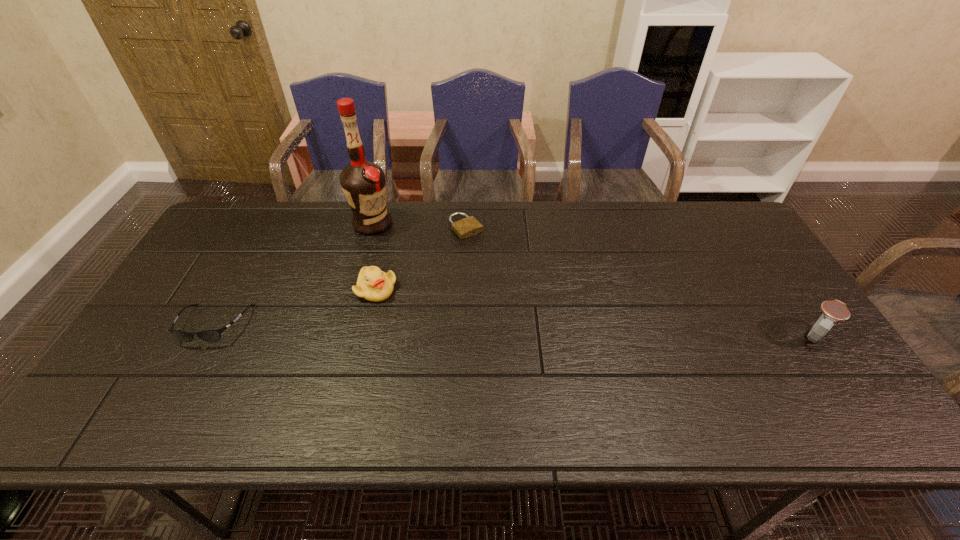
The image size is (960, 540). Identify the location of vacant space on the desktop that is between the sunglasses and the rightmost object and is positioned on the keyhole side of the shortest object. (566, 332).

Find the location of a particular element. The height and width of the screenshot is (540, 960). vacant spot on the desktop that is between the sunglasses and the rightmost object and is positioned on the front and back of the liquor is located at coordinates (444, 329).

The width and height of the screenshot is (960, 540). Identify the location of vacant space on the desktop that is between the second shortest object and the watch and is positioned at the face of the third shortest object. (439, 329).